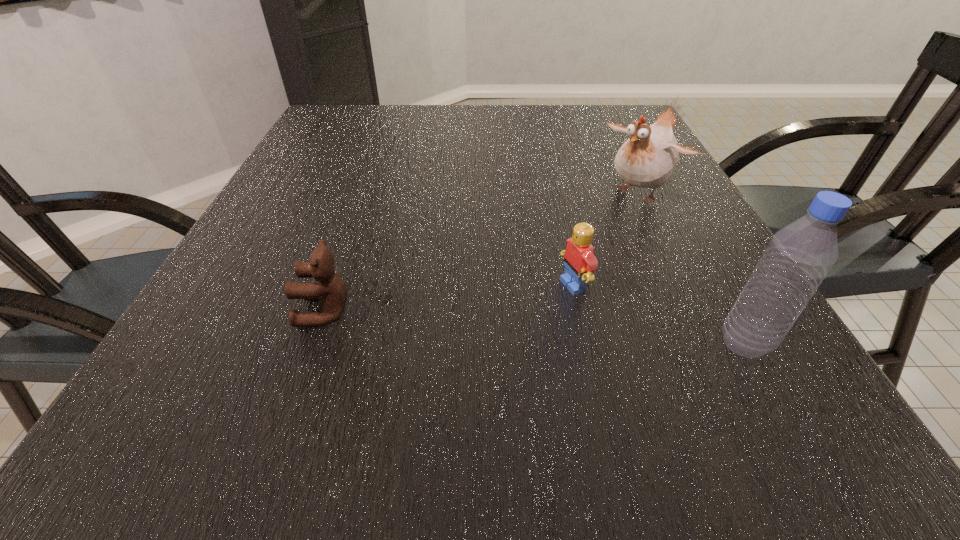
The width and height of the screenshot is (960, 540). In order to click on teddy bear in this screenshot , I will do `click(331, 291)`.

Image resolution: width=960 pixels, height=540 pixels. I want to click on bottle, so click(799, 256).

Where is `the farthest object`? the farthest object is located at coordinates (648, 158).

You are a GUI agent. You are given a task and a screenshot of the screen. Output one action in this format:
    pyautogui.click(x=<x>, y=<y>)
    Task: Click on the second tallest object
    
    Given the screenshot: What is the action you would take?
    pyautogui.click(x=648, y=158)

Where is `the second object from left to right`? the second object from left to right is located at coordinates (579, 261).

Where is `vacant region located 0.160m on the face of the leftmost object`? vacant region located 0.160m on the face of the leftmost object is located at coordinates (201, 311).

Locate an element on the screen. Image resolution: width=960 pixels, height=540 pixels. vacant region located 0.060m on the face of the leftmost object is located at coordinates (263, 311).

At what (x,y) coordinates should I click in order to perform the action: click on vacant space located on the face of the leftmost object. Please return your answer as a coordinate pair (x, y). The width and height of the screenshot is (960, 540). Looking at the image, I should click on (195, 311).

Where is `free space located 0.330m on the back of the tallest object`? free space located 0.330m on the back of the tallest object is located at coordinates (669, 206).

The width and height of the screenshot is (960, 540). What are the coordinates of `vacant point located 0.150m at the beak of the third shortest object` in the screenshot? It's located at (577, 241).